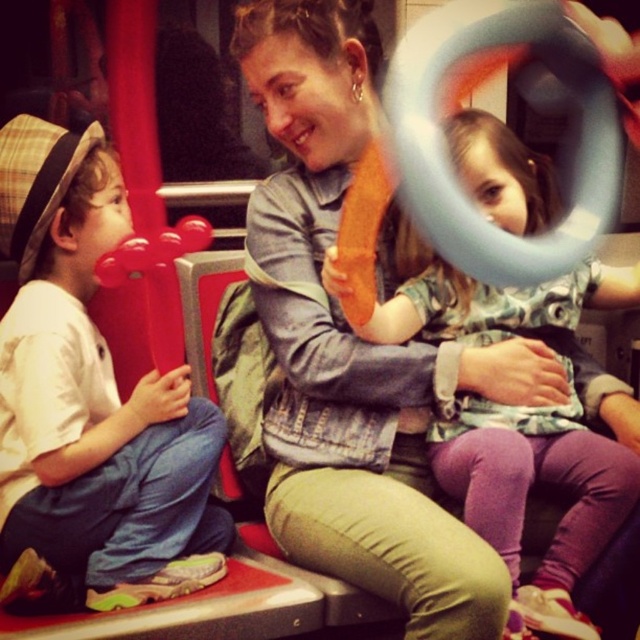
You are a passenger on a train and see the matte red balloon at left and the matte orange balloon at center. Which balloon is closer to the ceiling?

The matte orange balloon at center is closer to the ceiling because it is taller than the matte red balloon at left.

You are a passenger on a train and see the matte red balloon at left and the matte orange balloon at center. The train has a rule that balloons must be at least 60 centimeters apart to prevent them from popping. Are the balloons currently in compliance with this rule?

The matte red balloon at left is 57.01 centimeters away from the matte orange balloon at center. Since 57.01 cm is less than the required 60 cm, the balloons are not in compliance with the rule and need to be moved further apart.

You are standing in the train and want to place a small sticker on one of two points. The first point is at coordinate point (72, 420) and the second is at point (522, 436). Which point is closer to you?

Point (72, 420) is closer to the viewer than point (522, 436).